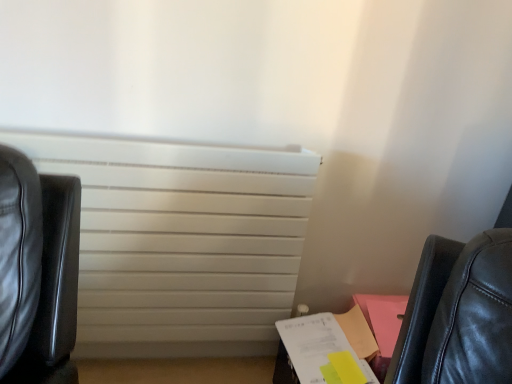
Question: Is white paper at lower right to the right of white matte radiator at center from the viewer's perspective?

Choices:
 (A) yes
 (B) no

Answer: (A)

Question: Are white paper at lower right and white matte radiator at center beside each other?

Choices:
 (A) yes
 (B) no

Answer: (B)

Question: From the image's perspective, is white paper at lower right over white matte radiator at center?

Choices:
 (A) yes
 (B) no

Answer: (B)

Question: From a real-world perspective, is white paper at lower right positioned over white matte radiator at center based on gravity?

Choices:
 (A) yes
 (B) no

Answer: (B)

Question: Is white paper at lower right oriented away from white matte radiator at center?

Choices:
 (A) yes
 (B) no

Answer: (B)

Question: From the image's perspective, is white paper at lower right located beneath white matte radiator at center?

Choices:
 (A) yes
 (B) no

Answer: (A)

Question: Considering the relative sizes of white matte radiator at center and white paper at lower right in the image provided, is white matte radiator at center wider than white paper at lower right?

Choices:
 (A) no
 (B) yes

Answer: (A)

Question: Is white matte radiator at center behind white paper at lower right?

Choices:
 (A) yes
 (B) no

Answer: (B)

Question: Does white matte radiator at center appear on the right side of white paper at lower right?

Choices:
 (A) no
 (B) yes

Answer: (A)

Question: Is the depth of white matte radiator at center less than that of white paper at lower right?

Choices:
 (A) no
 (B) yes

Answer: (B)

Question: From a real-world perspective, does white matte radiator at center sit lower than white paper at lower right?

Choices:
 (A) no
 (B) yes

Answer: (A)

Question: Is white matte radiator at center positioned far away from white paper at lower right?

Choices:
 (A) yes
 (B) no

Answer: (B)

Question: Looking at their shapes, would you say white matte radiator at center is wider or thinner than white paper at lower right?

Choices:
 (A) wide
 (B) thin

Answer: (B)